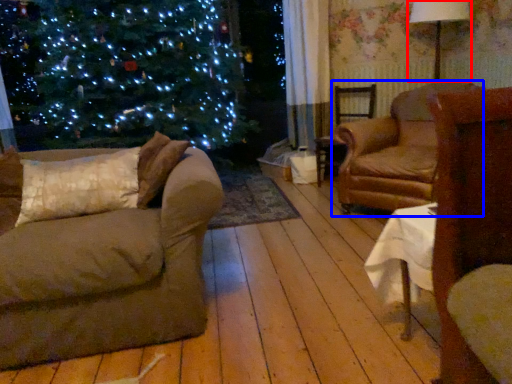
Question: Which point is further to the camera, lamp (highlighted by a red box) or chair (highlighted by a blue box)?

Choices:
 (A) lamp
 (B) chair

Answer: (A)